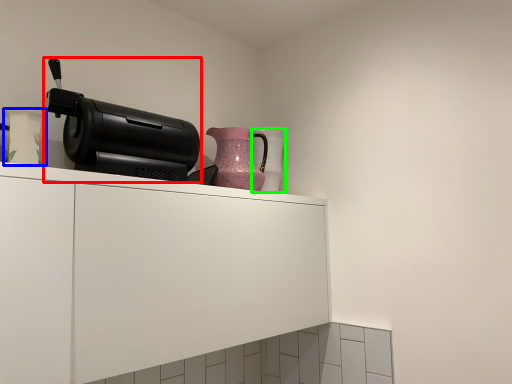
Question: Which object is the closest to the home appliance (highlighted by a red box)? Choose among these: vase (highlighted by a blue box) or vase (highlighted by a green box).

Choices:
 (A) vase
 (B) vase

Answer: (A)